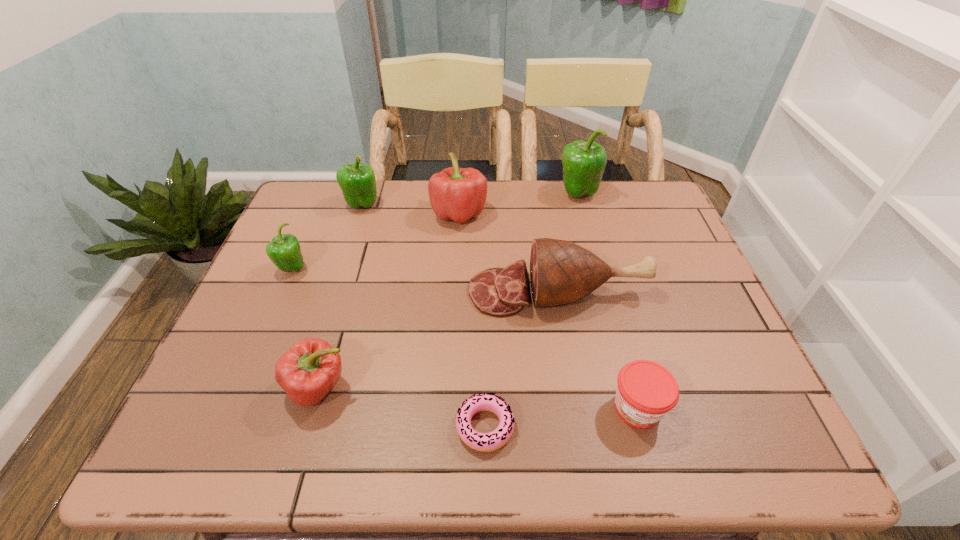
At what (x,y) coordinates should I click in order to perform the action: click on free location that satisfies the following two spatial constraints: 1. on the back side of the rightmost green bell pepper; 2. on the left side of the second green bell pepper from left to right. Please return your answer as a coordinate pair (x, y). Looking at the image, I should click on (366, 193).

The width and height of the screenshot is (960, 540). I want to click on free spot that satisfies the following two spatial constraints: 1. on the front side of the nearer pink bell pepper; 2. on the left side of the second green bell pepper from right to left, so click(x=303, y=388).